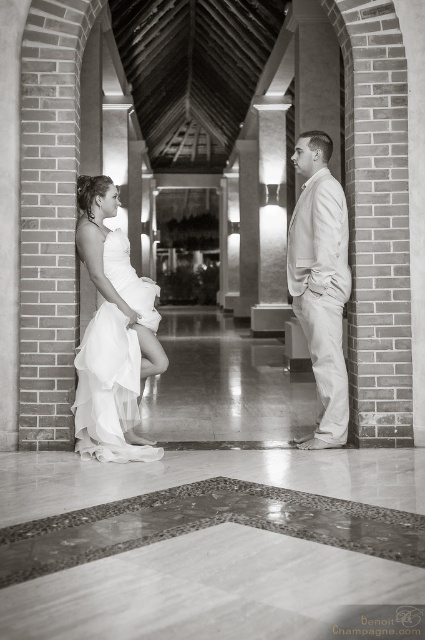
Question: Does white satin dress at left have a greater width compared to light beige suit at center?

Choices:
 (A) no
 (B) yes

Answer: (B)

Question: Among these points, which one is nearest to the camera?

Choices:
 (A) [311, 163]
 (B) [129, 378]
 (C) [317, 324]

Answer: (B)

Question: Among these objects, which one is farthest from the camera?

Choices:
 (A) white satin dress at left
 (B) white tulle dress at center
 (C) light beige suit at center

Answer: (C)

Question: Among these points, which one is farthest from the camera?

Choices:
 (A) (147, 296)
 (B) (319, 296)

Answer: (B)

Question: Is white satin dress at left to the left of light beige suit at center from the viewer's perspective?

Choices:
 (A) yes
 (B) no

Answer: (A)

Question: Is light beige suit at center to the right of white tulle dress at center from the viewer's perspective?

Choices:
 (A) yes
 (B) no

Answer: (A)